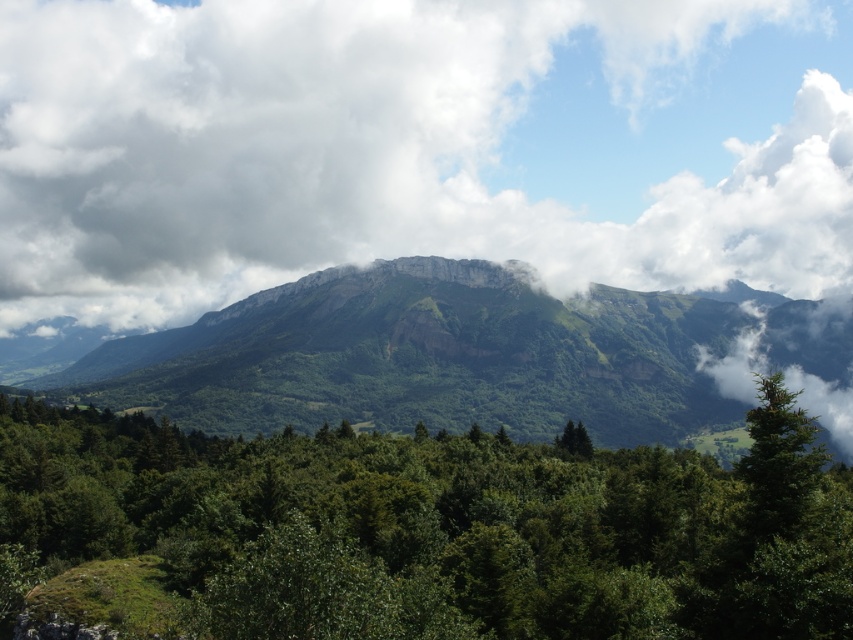
Does green textured mountain at center appear on the left side of green matte tree at lower right?

Indeed, green textured mountain at center is positioned on the left side of green matte tree at lower right.

Between green textured mountain at center and green matte tree at lower right, which one is positioned lower?

green matte tree at lower right

Between point (120, 356) and point (762, 381), which one is positioned behind?

Point (120, 356)

I want to click on green textured mountain at center, so click(x=473, y=355).

Is white fluffy cloud at upper center above green leafy tree at center?

Indeed, white fluffy cloud at upper center is positioned over green leafy tree at center.

Image resolution: width=853 pixels, height=640 pixels. What do you see at coordinates (415, 145) in the screenshot?
I see `white fluffy cloud at upper center` at bounding box center [415, 145].

This screenshot has width=853, height=640. What are the coordinates of `white fluffy cloud at upper center` in the screenshot? It's located at (415, 145).

The image size is (853, 640). Find the location of `green leafy tree at center`. green leafy tree at center is located at coordinates (439, 529).

Does green leafy tree at center have a greater width compared to green textured mountain at center?

In fact, green leafy tree at center might be narrower than green textured mountain at center.

Is point (241, 529) closer to viewer compared to point (817, 381)?

Yes, point (241, 529) is in front of point (817, 381).

You are a GUI agent. You are given a task and a screenshot of the screen. Output one action in this format:
    pyautogui.click(x=<x>, y=<y>)
    Task: Click on the green leafy tree at center
    
    Given the screenshot: What is the action you would take?
    click(439, 529)